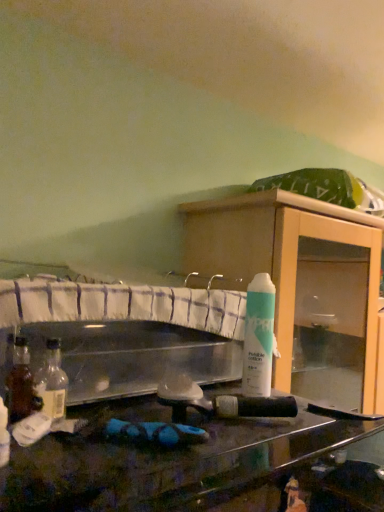
Question: From the image's perspective, would you say translucent plastic bottle at lower left, which ranks as the 2th bottle in right-to-left order, is positioned over white matte spray can at upper right?

Choices:
 (A) no
 (B) yes

Answer: (A)

Question: Considering the relative positions of translucent plastic bottle at lower left, which ranks as the 2th bottle in right-to-left order, and white matte spray can at upper right in the image provided, is translucent plastic bottle at lower left, which ranks as the 2th bottle in right-to-left order, behind white matte spray can at upper right?

Choices:
 (A) no
 (B) yes

Answer: (A)

Question: From a real-world perspective, is translucent plastic bottle at lower left, which appears as the 1th bottle when viewed from the left, below white matte spray can at upper right?

Choices:
 (A) no
 (B) yes

Answer: (B)

Question: Can you confirm if translucent plastic bottle at lower left, which appears as the second bottle when viewed from the back, is smaller than white matte spray can at upper right?

Choices:
 (A) no
 (B) yes

Answer: (B)

Question: From a real-world perspective, is translucent plastic bottle at lower left, positioned as the 1th bottle in front-to-back order, on top of white matte spray can at upper right?

Choices:
 (A) yes
 (B) no

Answer: (B)

Question: Is translucent plastic bottle at lower left, which appears as the second bottle when viewed from the back, in front of or behind white matte spray can at upper right in the image?

Choices:
 (A) front
 (B) behind

Answer: (A)

Question: From the image's perspective, is translucent plastic bottle at lower left, which appears as the second bottle when viewed from the back, located above or below white matte spray can at upper right?

Choices:
 (A) below
 (B) above

Answer: (A)

Question: From a real-world perspective, is translucent plastic bottle at lower left, which appears as the 1th bottle when viewed from the left, physically located above or below white matte spray can at upper right?

Choices:
 (A) below
 (B) above

Answer: (A)

Question: Does point (3, 444) appear closer or farther from the camera than point (256, 308)?

Choices:
 (A) farther
 (B) closer

Answer: (B)

Question: Is point (x=249, y=368) closer or farther from the camera than point (x=261, y=266)?

Choices:
 (A) farther
 (B) closer

Answer: (B)

Question: In the image, is white matte spray can at upper right positioned in front of or behind wooden cabinet at center?

Choices:
 (A) behind
 (B) front

Answer: (B)

Question: From the image's perspective, is white matte spray can at upper right positioned above or below wooden cabinet at center?

Choices:
 (A) above
 (B) below

Answer: (A)

Question: Choose the correct answer: Is white matte spray can at upper right inside wooden cabinet at center or outside it?

Choices:
 (A) inside
 (B) outside

Answer: (B)

Question: From the image's perspective, is translucent glass bottle at left, the first bottle when ordered from right to left, located above or below white matte spray can at upper right?

Choices:
 (A) below
 (B) above

Answer: (A)

Question: Relative to white matte spray can at upper right, is translucent glass bottle at left, the first bottle when ordered from right to left, in front or behind?

Choices:
 (A) front
 (B) behind

Answer: (A)